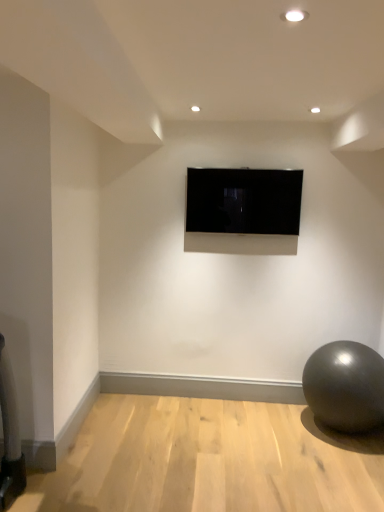
Find the location of a particular element. This screenshot has height=512, width=384. vacant area situated below black glossy tv at center (from a real-world perspective) is located at coordinates (244, 398).